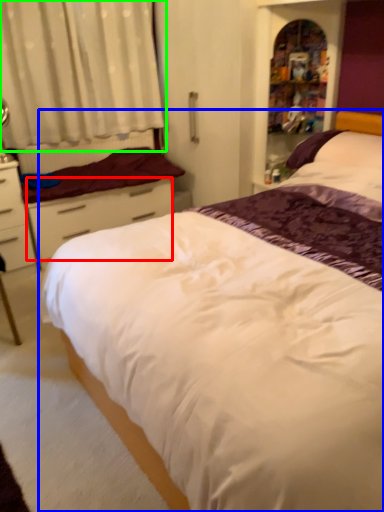
Question: Estimate the real-world distances between objects in this image. Which object is farther from drawer (highlighted by a red box), bed (highlighted by a blue box) or curtain (highlighted by a green box)?

Choices:
 (A) bed
 (B) curtain

Answer: (A)